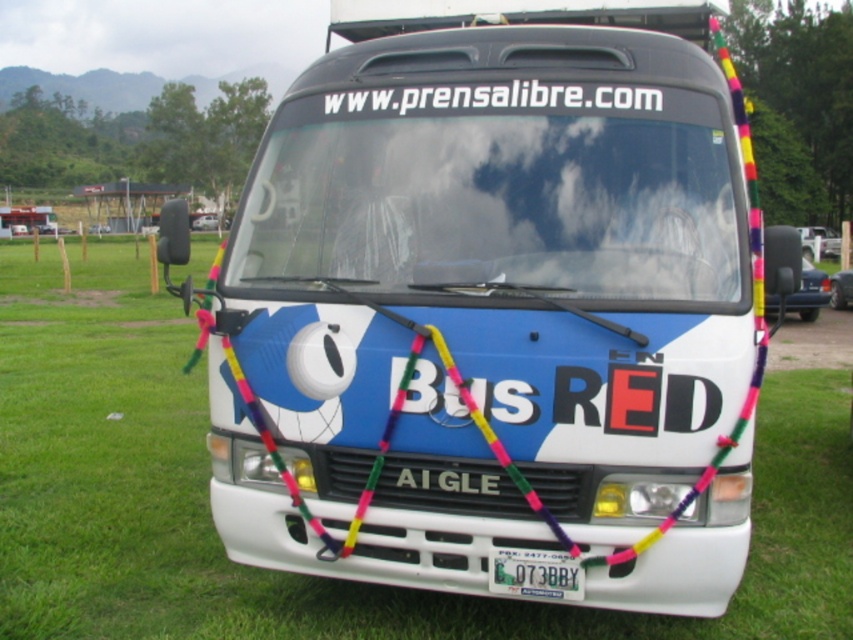
You are a delivery person trying to find the bus plate to deliver a package. You see the green grass at center and the green metallic license plate at center. Which one is above the other?

The green grass at center is positioned over the green metallic license plate at center, so the green grass at center is above the green metallic license plate at center.

You are a photographer trying to capture the entire bus in a single shot. The bus is parked on green grass at center and has white matte text at center on its front. Based on their widths, which object would require you to step back more to include it fully in the frame?

The green grass at center might be wider than white matte text at center, so you might need to step back more to include the green grass at center in the frame.

You are a delivery person who needs to read the website address on the bus windshield. The white matte text at center and green metallic license plate at center are in your line of sight. Which object is smaller in height?

The white matte text at center has a lesser height compared to the green metallic license plate at center, so the white matte text at center is smaller in height.